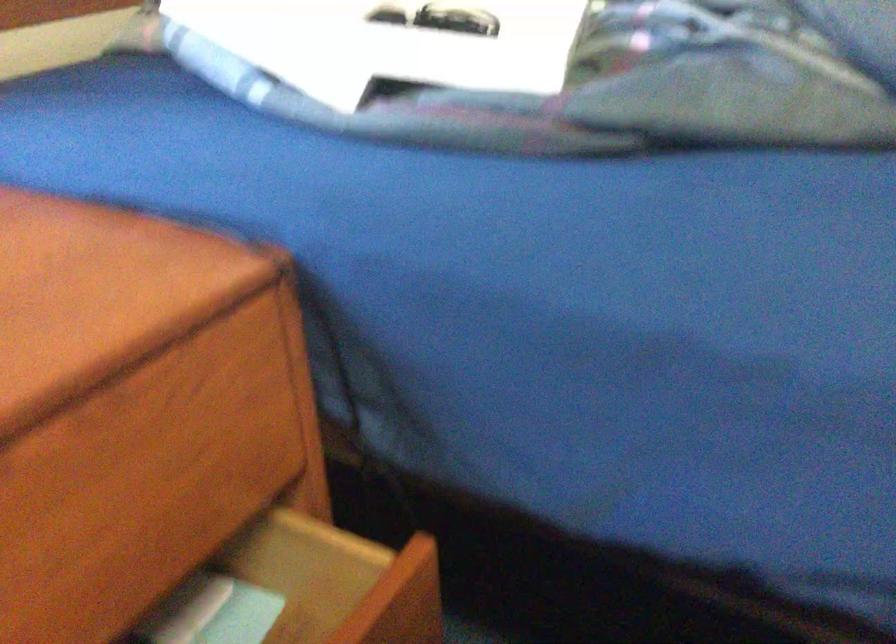
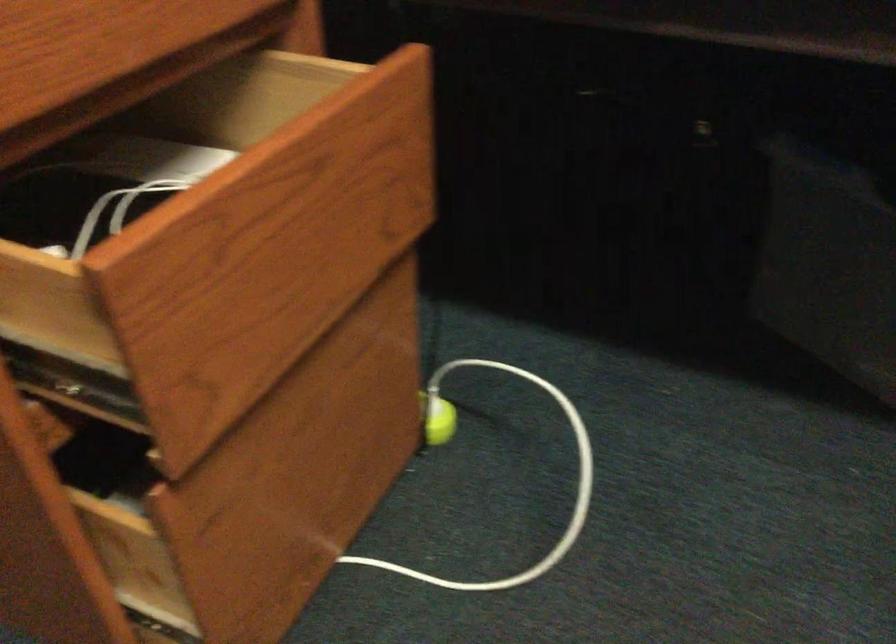
Question: The first image is from the beginning of the video and the second image is from the end. How did the camera likely rotate when shooting the video?

Choices:
 (A) Left
 (B) Right
 (C) Up
 (D) Down

Answer: (D)